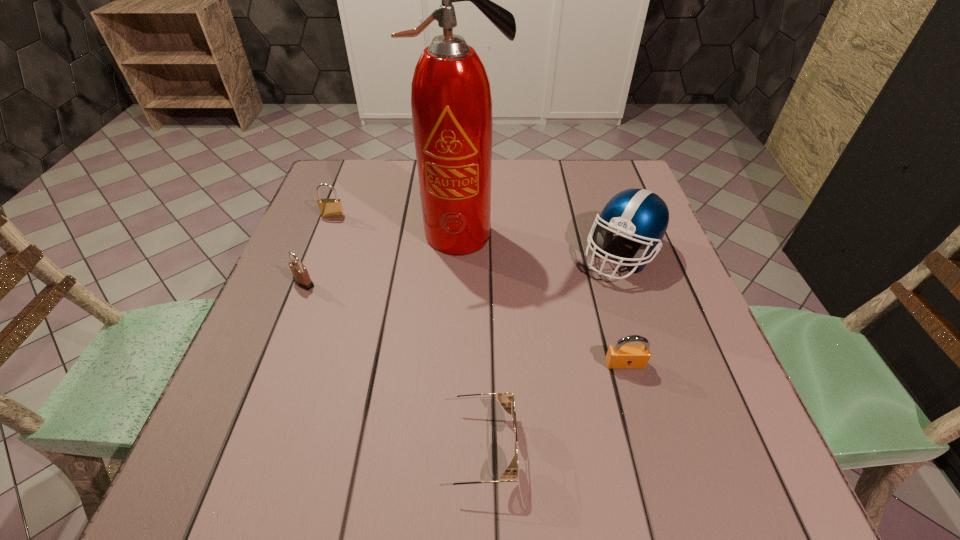
Identify the location of fire extinguisher. (x=451, y=103).

What are the coordinates of `football helmet` in the screenshot? It's located at (640, 215).

The image size is (960, 540). What are the coordinates of `the farthest padlock` in the screenshot? It's located at (329, 208).

Identify the location of the second farthest padlock. [x=301, y=277].

The width and height of the screenshot is (960, 540). I want to click on the rightmost padlock, so click(x=619, y=356).

Locate an element on the screen. the nearest padlock is located at coordinates (619, 356).

Where is `the shortest object`? Image resolution: width=960 pixels, height=540 pixels. the shortest object is located at coordinates tap(505, 398).

Image resolution: width=960 pixels, height=540 pixels. I want to click on sunglasses, so click(x=505, y=398).

In order to click on free space located 0.120m on the left of the tallest object in this screenshot , I will do `click(372, 235)`.

Where is `free space located 0.370m at the front of the football helmet with the faceguard`? This screenshot has height=540, width=960. free space located 0.370m at the front of the football helmet with the faceguard is located at coordinates (686, 450).